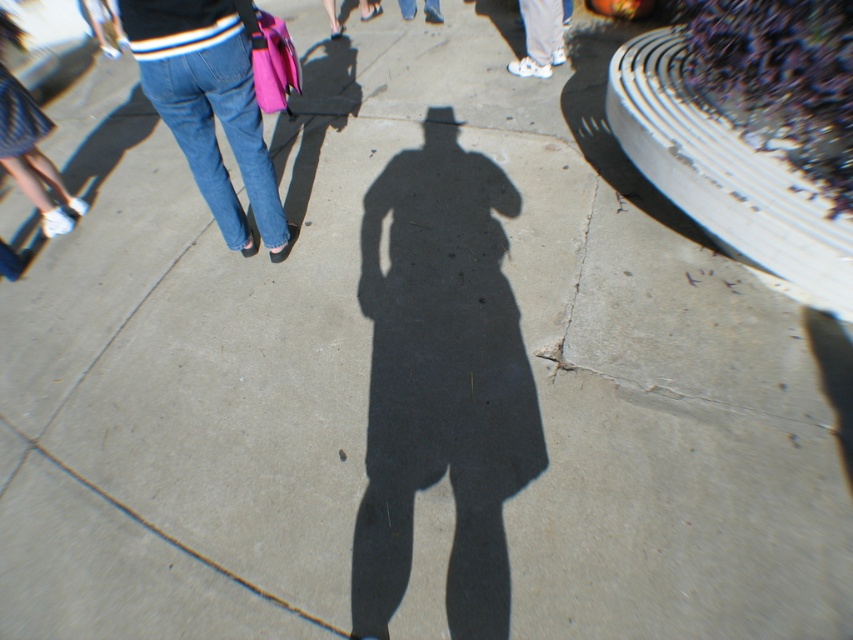
You are a photographer standing on the sidewalk and notice a woman walking away from you. You see the denim jeans at center and the white matte sneakers at upper right. Which item is closer to you?

The denim jeans at center is closer to the viewer than the white matte sneakers at upper right.

You are a photographer standing on the sidewalk. You notice the white matte sneakers at upper right and the blue denim jeans at center in your viewfinder. Which object is closer to the ground?

The white matte sneakers at upper right is positioned under the blue denim jeans at center, so it is closer to the ground.